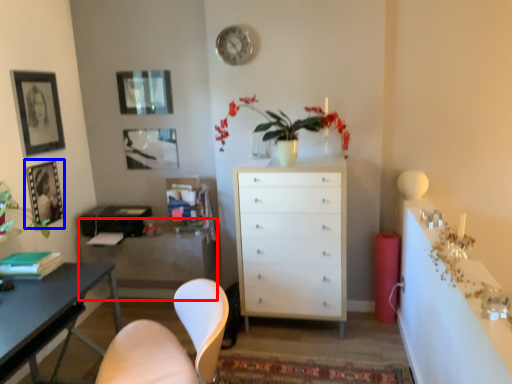
Question: Which object appears closest to the camera in this image, cabinetry (highlighted by a red box) or picture frame (highlighted by a blue box)?

Choices:
 (A) cabinetry
 (B) picture frame

Answer: (B)